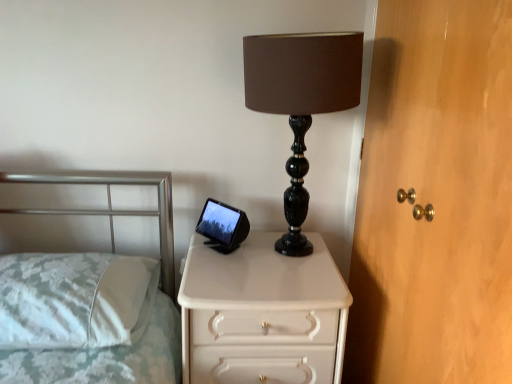
Describe the element at coordinates (301, 101) in the screenshot. I see `black marble lamp at center` at that location.

The width and height of the screenshot is (512, 384). What do you see at coordinates (262, 313) in the screenshot? I see `white glossy chest of drawers at center` at bounding box center [262, 313].

Image resolution: width=512 pixels, height=384 pixels. Identify the location of white glossy chest of drawers at center. (262, 313).

This screenshot has height=384, width=512. What do you see at coordinates (435, 199) in the screenshot?
I see `wooden dresser at right` at bounding box center [435, 199].

This screenshot has width=512, height=384. Describe the element at coordinates (75, 299) in the screenshot. I see `white fabric pillow at left` at that location.

At what (x,y) coordinates should I click in order to perform the action: click on black marble lamp at center. Please return your answer as a coordinate pair (x, y). Looking at the image, I should click on (301, 101).

How many degrees apart are the facing directions of white glossy chest of drawers at center and wooden dresser at right?

The facing directions of white glossy chest of drawers at center and wooden dresser at right are 91.7 degrees apart.

Can wooden dresser at right be found inside white glossy chest of drawers at center?

Definitely not — wooden dresser at right is not inside white glossy chest of drawers at center.

In the scene shown: Is white glossy chest of drawers at center facing away from wooden dresser at right?

No, wooden dresser at right is not at the back of white glossy chest of drawers at center.

Looking at the image, does white glossy chest of drawers at center seem bigger or smaller compared to wooden dresser at right?

Considering their sizes, white glossy chest of drawers at center takes up more space than wooden dresser at right.

Can you tell me how much white fabric pillow at left and white glossy chest of drawers at center differ in facing direction?

The angle between the facing direction of white fabric pillow at left and the facing direction of white glossy chest of drawers at center is 0.333 degrees.

Considering the relative sizes of white fabric pillow at left and white glossy chest of drawers at center in the image provided, is white fabric pillow at left shorter than white glossy chest of drawers at center?

Yes.

Does white fabric pillow at left contain white glossy chest of drawers at center?

No, white glossy chest of drawers at center is not a part of white fabric pillow at left.

Who is smaller, white fabric pillow at left or white glossy chest of drawers at center?

white fabric pillow at left is smaller.

Looking at the image, does white fabric pillow at left seem bigger or smaller compared to black marble lamp at center?

Considering their sizes, white fabric pillow at left takes up less space than black marble lamp at center.

Who is taller, white fabric pillow at left or black marble lamp at center?

black marble lamp at center is taller.

Is point (110, 296) positioned before point (349, 103)?

No, it is not.

Is black marble lamp at center at the right side of white fabric pillow at left?

Yes.

Based on the photo, from the image's perspective, is black marble lamp at center positioned above or below white fabric pillow at left?

Result: black marble lamp at center is situated higher than white fabric pillow at left in the image.

The image size is (512, 384). Identify the location of lamp in front of the white fabric pillow at left. (301, 101).

Can you confirm if black marble lamp at center is shorter than white fabric pillow at left?

No.

Is white glossy chest of drawers at center placed right next to black marble lamp at center?

There is a gap between white glossy chest of drawers at center and black marble lamp at center.

Is white glossy chest of drawers at center oriented towards black marble lamp at center?

No, white glossy chest of drawers at center is not aimed at black marble lamp at center.

From the image's perspective, between white glossy chest of drawers at center and black marble lamp at center, who is located below?

From the image's view, white glossy chest of drawers at center is below.

Is white glossy chest of drawers at center to the right of white fabric pillow at left from the viewer's perspective?

Indeed, white glossy chest of drawers at center is positioned on the right side of white fabric pillow at left.

In the scene shown: Considering their positions, is white glossy chest of drawers at center located in front of or behind white fabric pillow at left?

white glossy chest of drawers at center is behind white fabric pillow at left.

Does white glossy chest of drawers at center have a larger size compared to white fabric pillow at left?

Correct, white glossy chest of drawers at center is larger in size than white fabric pillow at left.

I want to click on pillow above the white glossy chest of drawers at center (from a real-world perspective), so pyautogui.click(x=75, y=299).

Considering the relative sizes of wooden dresser at right and white glossy chest of drawers at center in the image provided, is wooden dresser at right shorter than white glossy chest of drawers at center?

No.

Between wooden dresser at right and white glossy chest of drawers at center, which one has smaller width?

wooden dresser at right.

Considering the points (461, 39) and (209, 258), which point is behind, point (461, 39) or point (209, 258)?

The point (209, 258) is more distant.

Could white glossy chest of drawers at center be considered to be inside wooden dresser at right?

Actually, white glossy chest of drawers at center is outside wooden dresser at right.

Find the location of `dresser above the white glossy chest of drawers at center (from the image's perspective)`. dresser above the white glossy chest of drawers at center (from the image's perspective) is located at coordinates (435, 199).

Where is `chest of drawers below the white fabric pillow at left (from the image's perspective)`? This screenshot has height=384, width=512. chest of drawers below the white fabric pillow at left (from the image's perspective) is located at coordinates (262, 313).

Considering their positions, is wooden dresser at right positioned closer to white fabric pillow at left than black marble lamp at center?

black marble lamp at center is positioned closer to the anchor white fabric pillow at left.

Looking at this image, estimate the real-world distances between objects in this image. Which object is closer to white fabric pillow at left, white glossy chest of drawers at center or black marble lamp at center?

white glossy chest of drawers at center lies closer to white fabric pillow at left than the other object.

Considering their positions, is white glossy chest of drawers at center positioned closer to white fabric pillow at left than wooden dresser at right?

The object closer to white fabric pillow at left is white glossy chest of drawers at center.

Considering their positions, is wooden dresser at right positioned closer to black marble lamp at center than white fabric pillow at left?

Among the two, wooden dresser at right is located nearer to black marble lamp at center.

Estimate the real-world distances between objects in this image. Which object is closer to black marble lamp at center, white fabric pillow at left or wooden dresser at right?

wooden dresser at right is positioned closer to the anchor black marble lamp at center.

Which object lies further to the anchor point wooden dresser at right, black marble lamp at center or white glossy chest of drawers at center?

white glossy chest of drawers at center.

Based on their spatial positions, is white fabric pillow at left or black marble lamp at center closer to wooden dresser at right?

black marble lamp at center.

Estimate the real-world distances between objects in this image. Which object is closer to white fabric pillow at left, wooden dresser at right or white glossy chest of drawers at center?

The object closer to white fabric pillow at left is white glossy chest of drawers at center.

What are the coordinates of `lamp between wooden dresser at right and white glossy chest of drawers at center in the front-back direction` in the screenshot? It's located at (301, 101).

What are the coordinates of `chest of drawers between white fabric pillow at left and wooden dresser at right` in the screenshot? It's located at (262, 313).

At what (x,y) coordinates should I click in order to perform the action: click on lamp between white fabric pillow at left and wooden dresser at right. Please return your answer as a coordinate pair (x, y). The width and height of the screenshot is (512, 384). Looking at the image, I should click on (301, 101).

At what (x,y) coordinates should I click in order to perform the action: click on chest of drawers between white fabric pillow at left and black marble lamp at center. Please return your answer as a coordinate pair (x, y). This screenshot has width=512, height=384. Looking at the image, I should click on (262, 313).